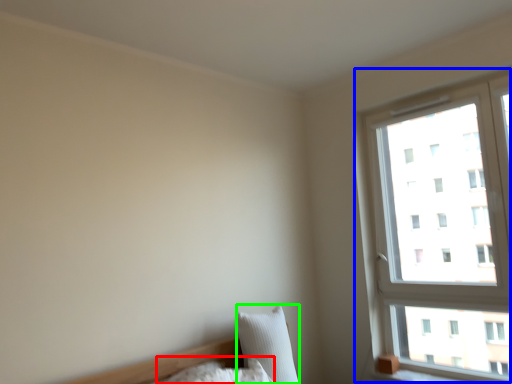
Question: Estimate the real-world distances between objects in this image. Which object is farther from pillow (highlighted by a red box), window (highlighted by a blue box) or pillow (highlighted by a green box)?

Choices:
 (A) window
 (B) pillow

Answer: (A)